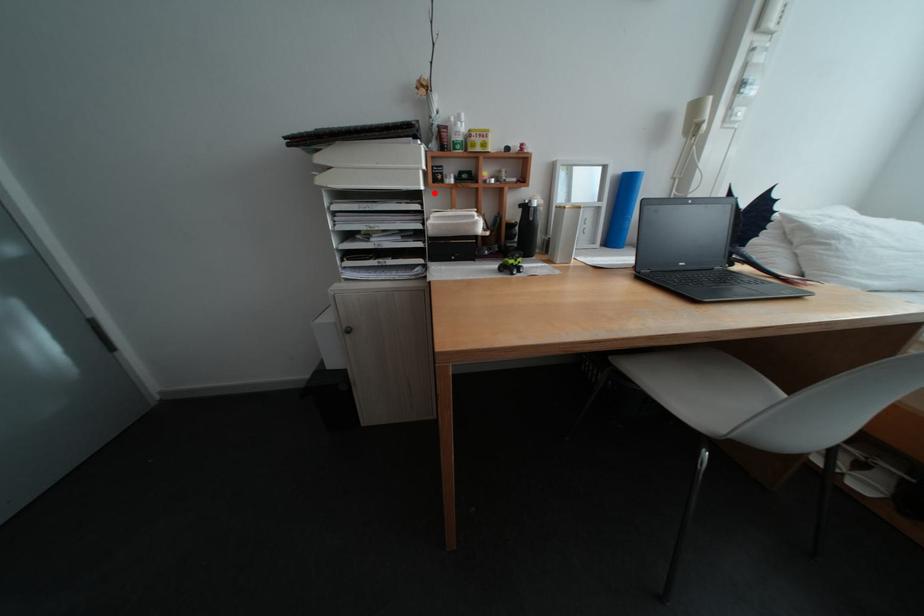
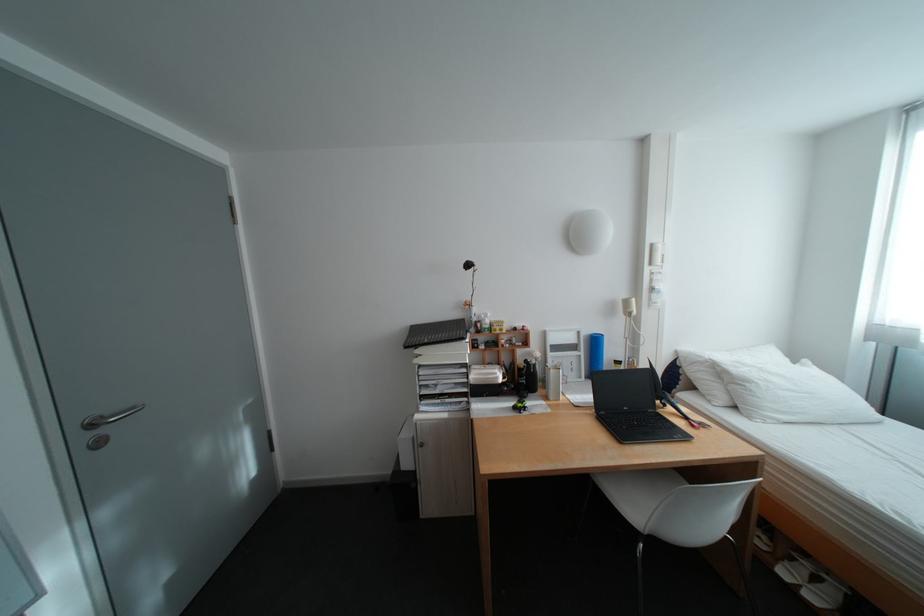
Question: A red point is marked in image1. In image2, is the corresponding 3D point closer to the camera or farther? Reply with the corresponding letter.

Choices:
 (A) The corresponding 3D point is closer.
 (B) The corresponding 3D point is farther.

Answer: (B)